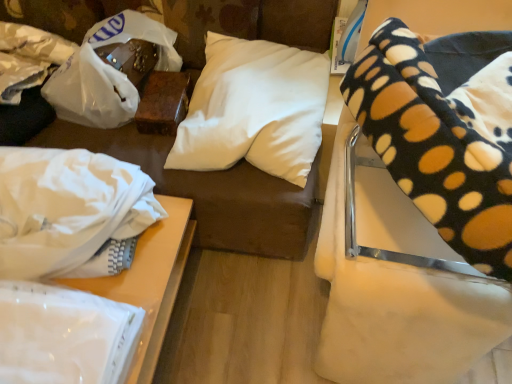
Measure the distance between white soft pillow at upper center and camera.

white soft pillow at upper center and camera are 3.82 feet apart.

In order to click on black polka dot blanket at upper right in this screenshot , I will do click(394, 254).

Looking at their sizes, would you say white fabric at lower left is wider or thinner than white fabric at left?

Considering their sizes, white fabric at lower left looks broader than white fabric at left.

Is white fabric at lower left inside or outside of white fabric at left?

white fabric at lower left lies outside white fabric at left.

Which is nearer, (153, 285) or (35, 255)?

Clearly, point (153, 285) is more distant from the camera than point (35, 255).

Considering the points (296, 150) and (106, 329), which point is in front, point (296, 150) or point (106, 329)?

Point (106, 329)

Could you tell me if white soft pillow at upper center is facing white glossy paper at lower left?

Yes, white soft pillow at upper center is aimed at white glossy paper at lower left.

How different are the orientations of white soft pillow at upper center and white glossy paper at lower left in degrees?

The angle between the facing direction of white soft pillow at upper center and the facing direction of white glossy paper at lower left is 2.64 degrees.

Image resolution: width=512 pixels, height=384 pixels. I want to click on linen located in front of the white soft pillow at upper center, so click(64, 335).

Is white soft pillow at upper center surrounded by black polka dot blanket at upper right?

No, white soft pillow at upper center is not inside black polka dot blanket at upper right.

From a real-world perspective, is black polka dot blanket at upper right positioned above or below white soft pillow at upper center?

Clearly, from a real-world perspective, black polka dot blanket at upper right is below white soft pillow at upper center.

From the image's perspective, is black polka dot blanket at upper right above or below white soft pillow at upper center?

Clearly, from the image's perspective, black polka dot blanket at upper right is below white soft pillow at upper center.

Which object is further away from the camera taking this photo, black polka dot blanket at upper right or white soft pillow at upper center?

Positioned behind is white soft pillow at upper center.

Is white glossy paper at lower left not inside white fabric at lower left?

Yes, white glossy paper at lower left is outside of white fabric at lower left.

Consider the image. Considering the positions of objects white glossy paper at lower left and white fabric at lower left in the image provided, who is behind, white glossy paper at lower left or white fabric at lower left?

white fabric at lower left is more distant.

From the image's perspective, which one is positioned higher, white glossy paper at lower left or white fabric at lower left?

white glossy paper at lower left is shown above in the image.

Is white glossy paper at lower left next to white fabric at lower left?

No, white glossy paper at lower left is not in contact with white fabric at lower left.

Who is bigger, white fabric at lower left or white soft pillow at upper center?

Bigger between the two is white fabric at lower left.

How distant is white fabric at lower left from white soft pillow at upper center?

A distance of 14.02 inches exists between white fabric at lower left and white soft pillow at upper center.

In order to click on table in front of the white soft pillow at upper center in this screenshot , I will do `click(149, 273)`.

Which is in front, point (71, 282) or point (246, 137)?

The point (71, 282) is in front.

Is point (29, 158) positioned before point (137, 333)?

No, (29, 158) is further to viewer.

Is white glossy paper at lower left at the back of white fabric at left?

No, white fabric at left is not facing the opposite direction of white glossy paper at lower left.

Considering the relative sizes of white fabric at left and white glossy paper at lower left in the image provided, is white fabric at left taller than white glossy paper at lower left?

Indeed, white fabric at left has a greater height compared to white glossy paper at lower left.

Visually, is white fabric at left positioned to the left or to the right of white glossy paper at lower left?

Based on their positions, white fabric at left is located to the left of white glossy paper at lower left.

Does black polka dot blanket at upper right have a larger size compared to white glossy paper at lower left?

Correct, black polka dot blanket at upper right is larger in size than white glossy paper at lower left.

Considering the relative positions of black polka dot blanket at upper right and white glossy paper at lower left in the image provided, is black polka dot blanket at upper right to the left or to the right of white glossy paper at lower left?

black polka dot blanket at upper right is to the right of white glossy paper at lower left.

Based on the photo, is black polka dot blanket at upper right positioned far away from white glossy paper at lower left?

No, black polka dot blanket at upper right is not far from white glossy paper at lower left.

Is white glossy paper at lower left located within black polka dot blanket at upper right?

No, white glossy paper at lower left is located outside of black polka dot blanket at upper right.

Image resolution: width=512 pixels, height=384 pixels. Find the location of `table that is behind the white fabric at left`. table that is behind the white fabric at left is located at coordinates (149, 273).

Where is `pillow that is above the white glossy paper at lower left (from the image's perspective)`? This screenshot has width=512, height=384. pillow that is above the white glossy paper at lower left (from the image's perspective) is located at coordinates (254, 109).

Based on their spatial positions, is black polka dot blanket at upper right or white fabric at left further from white fabric at lower left?

black polka dot blanket at upper right is further to white fabric at lower left.

Estimate the real-world distances between objects in this image. Which object is closer to white soft pillow at upper center, white fabric at lower left or white fabric at left?

white fabric at lower left.

Considering their positions, is white fabric at lower left positioned closer to white soft pillow at upper center than white glossy paper at lower left?

Among the two, white fabric at lower left is located nearer to white soft pillow at upper center.

Looking at the image, which one is located further to white fabric at lower left, black polka dot blanket at upper right or white glossy paper at lower left?

black polka dot blanket at upper right is further to white fabric at lower left.

Considering their positions, is white fabric at lower left positioned closer to white glossy paper at lower left than white soft pillow at upper center?

white fabric at lower left is closer to white glossy paper at lower left.

Estimate the real-world distances between objects in this image. Which object is further from white fabric at lower left, white soft pillow at upper center or black polka dot blanket at upper right?

Among the two, black polka dot blanket at upper right is located further to white fabric at lower left.

Estimate the real-world distances between objects in this image. Which object is closer to black polka dot blanket at upper right, white glossy paper at lower left or white soft pillow at upper center?

Based on the image, white soft pillow at upper center appears to be nearer to black polka dot blanket at upper right.

Estimate the real-world distances between objects in this image. Which object is further from white glossy paper at lower left, white fabric at lower left or white fabric at left?

white fabric at left is positioned further to the anchor white glossy paper at lower left.

Locate an element on the screen. The image size is (512, 384). table between white fabric at left and black polka dot blanket at upper right in the horizontal direction is located at coordinates (149, 273).

Where is `material that lies between white soft pillow at upper center and white fabric at lower left from top to bottom`? material that lies between white soft pillow at upper center and white fabric at lower left from top to bottom is located at coordinates (67, 208).

The image size is (512, 384). In order to click on pillow between white fabric at left and black polka dot blanket at upper right in the horizontal direction in this screenshot , I will do `click(254, 109)`.

At what (x,y) coordinates should I click in order to perform the action: click on linen situated between white fabric at left and black polka dot blanket at upper right from left to right. Please return your answer as a coordinate pair (x, y). This screenshot has height=384, width=512. Looking at the image, I should click on (64, 335).